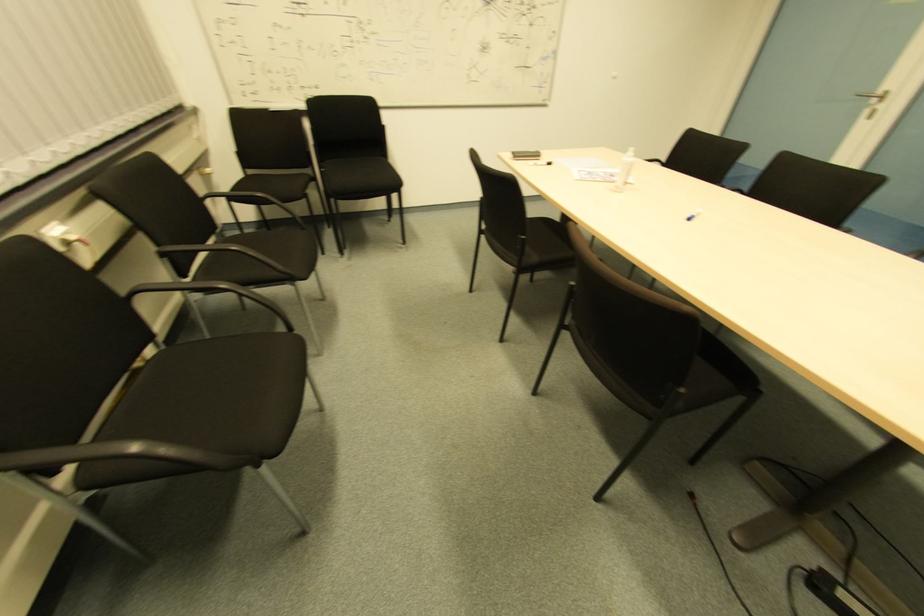
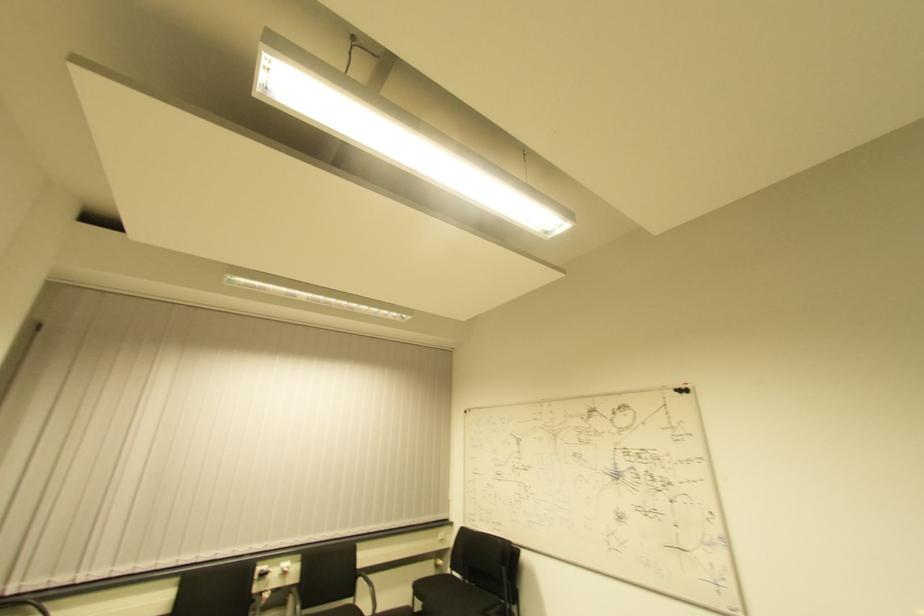
In the second image, find the point that corresponds to point 196,113 in the first image.

(450, 527)